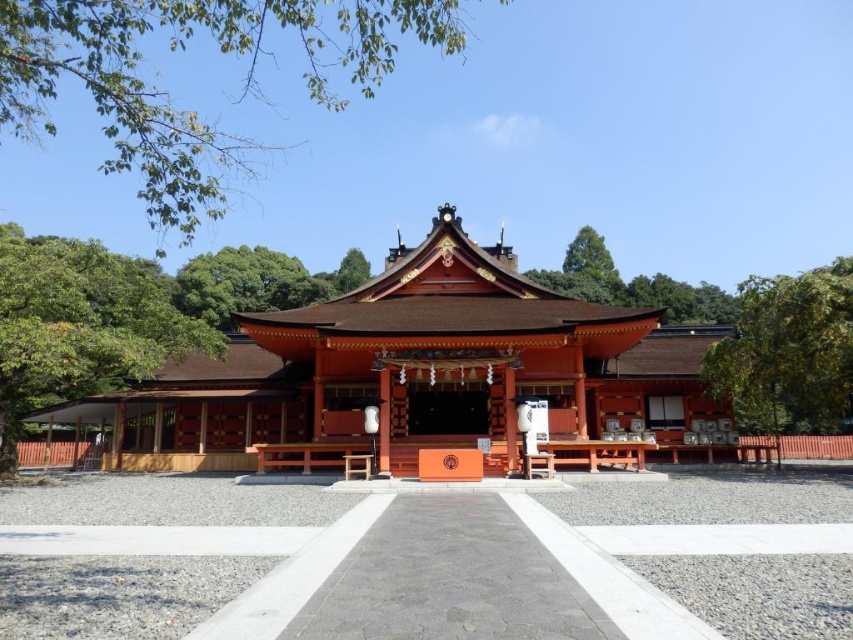
Question: Does green leafy tree at left have a greater width compared to green leafy tree at right?

Choices:
 (A) yes
 (B) no

Answer: (A)

Question: Which of the following is the farthest from the observer?

Choices:
 (A) (354, 392)
 (B) (19, 97)

Answer: (A)

Question: Can you confirm if green leafy tree at upper center is positioned below green leafy tree at left?

Choices:
 (A) no
 (B) yes

Answer: (A)

Question: Which of the following is the closest to the observer?

Choices:
 (A) (125, 308)
 (B) (228, 154)
 (C) (793, 291)

Answer: (C)

Question: Can you confirm if green leafy tree at upper center is wider than green leafy tree at left?

Choices:
 (A) no
 (B) yes

Answer: (B)

Question: Among these points, which one is nearest to the camera?

Choices:
 (A) (38, 83)
 (B) (68, 374)

Answer: (A)